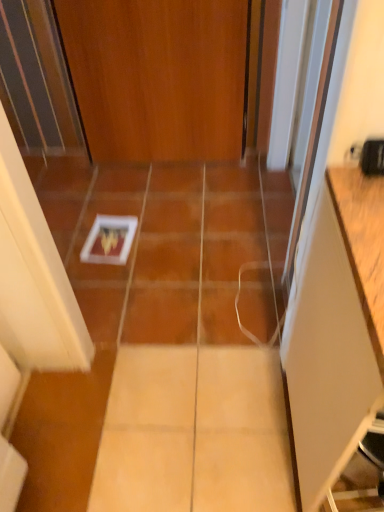
Question: From the image's perspective, relative to white matte cabinet at right, is wooden door at center above or below?

Choices:
 (A) above
 (B) below

Answer: (A)

Question: Is point (97, 138) closer or farther from the camera than point (327, 437)?

Choices:
 (A) closer
 (B) farther

Answer: (B)

Question: From a real-world perspective, is wooden door at center above or below white matte cabinet at right?

Choices:
 (A) below
 (B) above

Answer: (B)

Question: Relative to wooden door at center, is white matte cabinet at right in front or behind?

Choices:
 (A) front
 (B) behind

Answer: (A)

Question: Looking at the image, does white matte cabinet at right seem bigger or smaller compared to wooden door at center?

Choices:
 (A) big
 (B) small

Answer: (A)

Question: Does point 301,475 appear closer or farther from the camera than point 152,142?

Choices:
 (A) farther
 (B) closer

Answer: (B)

Question: Looking at their shapes, would you say white matte cabinet at right is wider or thinner than wooden door at center?

Choices:
 (A) wide
 (B) thin

Answer: (A)